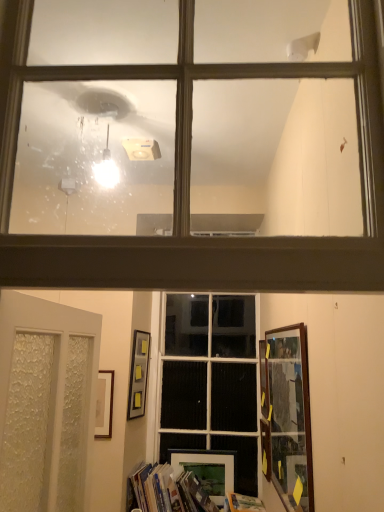
Question: Considering the relative positions of matte glass window at upper center, the 2th window positioned from the back, and wooden picture frame at lower right, which is the second picture frame from front to back, in the image provided, is matte glass window at upper center, the 2th window positioned from the back, to the left or to the right of wooden picture frame at lower right, which is the second picture frame from front to back,?

Choices:
 (A) right
 (B) left

Answer: (B)

Question: Which is correct: matte glass window at upper center, the 2th window positioned from the back, is inside wooden picture frame at lower right, which is the second picture frame from front to back, or outside of it?

Choices:
 (A) inside
 (B) outside

Answer: (B)

Question: Which of these objects is positioned farthest from the hardcover book at lower center?

Choices:
 (A) wooden picture frame at lower right, which is the second picture frame from front to back
 (B) matte black picture frame at lower center, positioned as the 1th picture frame in back-to-front order
 (C) hardcover book at lower center
 (D) matte glass window at upper center, the 1th window when ordered from top to bottom
 (E) wooden picture frame at right, the second picture frame in the right-to-left sequence

Answer: (D)

Question: Which object is positioned closest to the wooden picture frame at right, which ranks as the fourth picture frame in back-to-front order?

Choices:
 (A) wooden picture frame at lower right, acting as the 4th picture frame starting from the left
 (B) white frosted glass door at lower left
 (C) matte black picture frame at lower center, which ranks as the 2th picture frame in left-to-right order
 (D) hardcover book at lower center
 (E) matte glass window at upper center, the 2th window positioned from the back

Answer: (A)